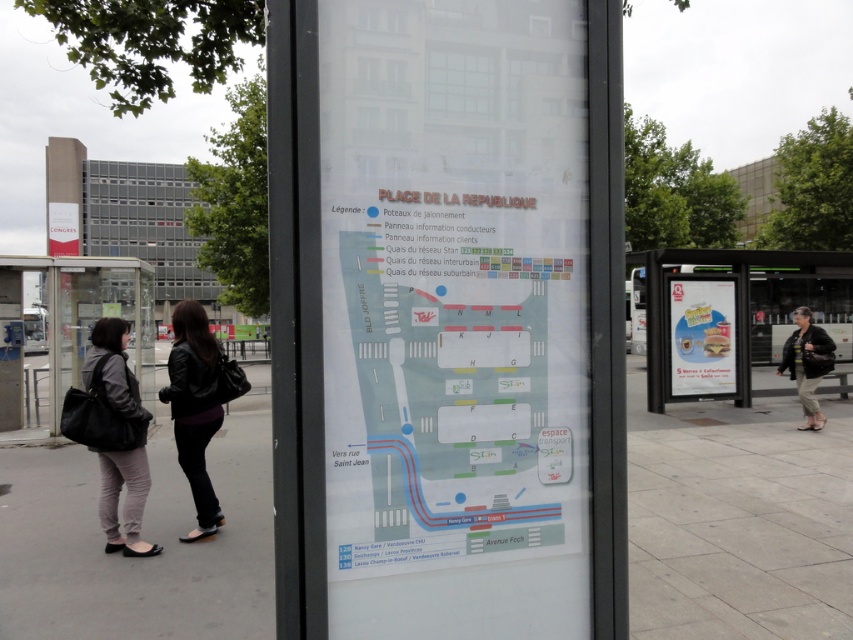
Is gray concrete pavement at lower left to the left of white fabric banner at upper left from the viewer's perspective?

No, gray concrete pavement at lower left is not to the left of white fabric banner at upper left.

Is point (3, 573) positioned before point (50, 241)?

Yes, point (3, 573) is in front of point (50, 241).

The image size is (853, 640). What are the coordinates of `gray concrete pavement at lower left` in the screenshot? It's located at (144, 536).

Who is more forward, (755, 278) or (817, 336)?

Point (817, 336) is more forward.

Between point (718, 387) and point (805, 340), which one is positioned in front?

Positioned in front is point (805, 340).

Image resolution: width=853 pixels, height=640 pixels. What are the coordinates of `white plastic bench at right` in the screenshot? It's located at (715, 316).

Is dark brown leather jacket at lower right bigger than white fabric banner at upper left?

No.

Which is more to the right, dark brown leather jacket at lower right or white fabric banner at upper left?

dark brown leather jacket at lower right is more to the right.

Who is more forward, (x=807, y=308) or (x=74, y=252)?

Point (x=807, y=308) is in front.

The height and width of the screenshot is (640, 853). What are the coordinates of `dark brown leather jacket at lower right` in the screenshot? It's located at (805, 364).